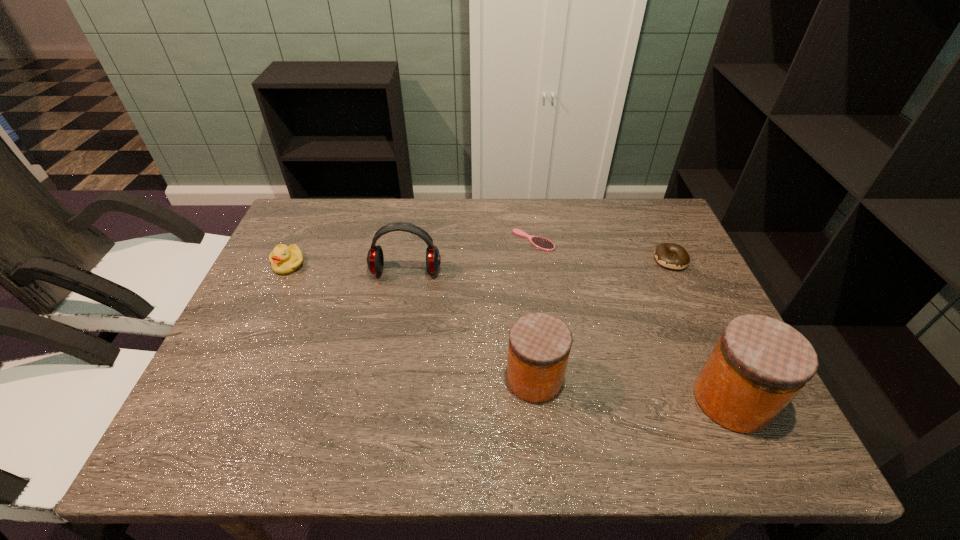
Locate an element on the screen. This screenshot has height=540, width=960. free space located 0.330m on the ear cups of the second object from left to right is located at coordinates (385, 388).

Identify the location of free space located 0.380m on the front of the hairbrush. (550, 360).

I want to click on free spot located 0.080m at the face of the leftmost object, so click(274, 298).

At what (x,y) coordinates should I click in order to perform the action: click on vacant region located 0.200m on the back of the doughnut. Please return your answer as a coordinate pair (x, y). The width and height of the screenshot is (960, 540). Looking at the image, I should click on (647, 209).

This screenshot has height=540, width=960. In order to click on object located at the far edge in this screenshot , I will do `click(541, 243)`.

Locate an element on the screen. This screenshot has width=960, height=540. object present at the left edge is located at coordinates point(284,259).

Locate an element on the screen. The height and width of the screenshot is (540, 960). jar that is at the right edge is located at coordinates (759, 364).

I want to click on doughnut located in the right edge section of the desktop, so click(663, 253).

You are a GUI agent. You are given a task and a screenshot of the screen. Output one action in this format:
    pyautogui.click(x=<x>, y=<y>)
    Task: Click on the object present at the near right corner
    The image size is (960, 540).
    Given the screenshot: What is the action you would take?
    pyautogui.click(x=759, y=364)

In order to click on vacant area at the far edge in this screenshot , I will do `click(475, 208)`.